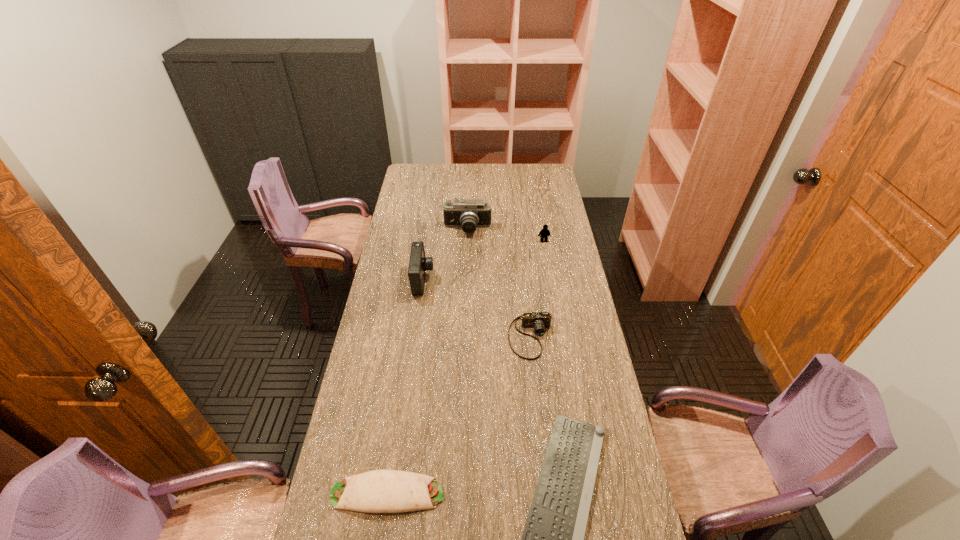
In the image, there is a desktop. Identify the location of vacant space at the right edge. This screenshot has width=960, height=540. (572, 320).

In the image, there is a desktop. Where is `free space at the far left corner`? The height and width of the screenshot is (540, 960). free space at the far left corner is located at coordinates (417, 171).

In the image, there is a desktop. Where is `vacant space at the far right corner`? This screenshot has width=960, height=540. vacant space at the far right corner is located at coordinates (540, 171).

Where is `vacant area that lies between the second farthest camera and the fourth shortest object`? The image size is (960, 540). vacant area that lies between the second farthest camera and the fourth shortest object is located at coordinates (483, 261).

The image size is (960, 540). I want to click on free spot between the farthest object and the fifth nearest object, so click(506, 235).

At what (x,y) coordinates should I click in order to perform the action: click on free space between the burrito and the fourth shortest object. Please return your answer as a coordinate pair (x, y). Looking at the image, I should click on (466, 367).

This screenshot has width=960, height=540. I want to click on vacant area that lies between the farthest camera and the rightmost camera, so click(499, 284).

You are a GUI agent. You are given a task and a screenshot of the screen. Output one action in this format:
    pyautogui.click(x=<x>, y=<y>)
    Task: Click on the free point between the fourth shortest object and the second shortest object
    
    Given the screenshot: What is the action you would take?
    pyautogui.click(x=466, y=367)

Image resolution: width=960 pixels, height=540 pixels. I want to click on vacant space that's between the burrito and the Lego, so click(466, 367).

This screenshot has height=540, width=960. In order to click on free space between the burrito and the farthest object in this screenshot , I will do `click(427, 361)`.